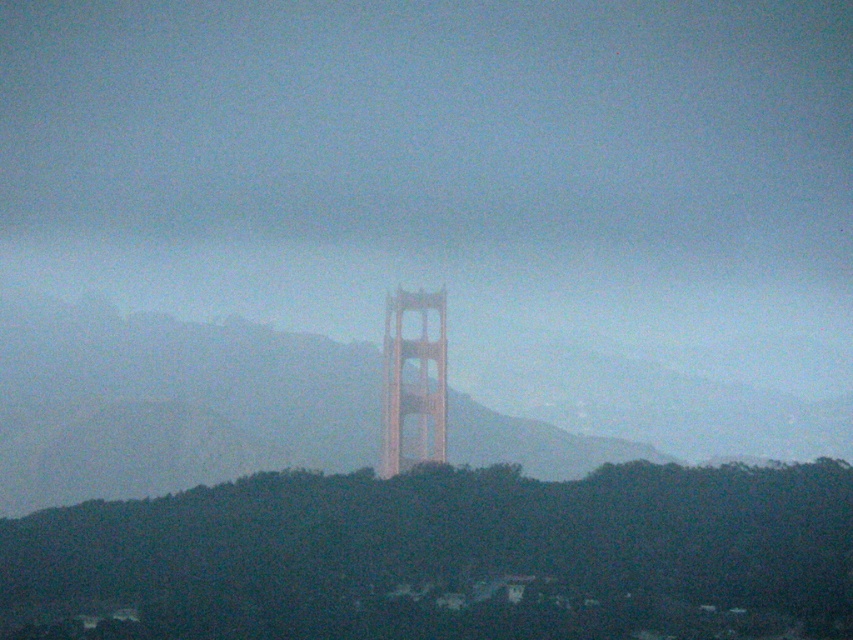
You are a photographer planning to capture the Golden Gate Bridge against the backdrop of the dark green foliage at center and the golden brown steel tower at center. Based on the scene, which object occupies a wider area in the frame?

The dark green foliage at center occupies a wider area in the frame as its width is larger than that of the golden brown steel tower at center.

You are a photographer planning to capture the Golden Gate Bridge on a foggy day. You want to ensure that both the dark green foliage at center and the golden brown steel tower at center are in focus simultaneously. Given that your camera has a depth of field range of 65 meters, will you be able to achieve this?

The dark green foliage at center and golden brown steel tower at center are 66.20 meters apart. Since the distance between them exceeds the camera depth of field range of 65 meters, the photographer cannot have both objects in focus simultaneously.

Looking at the Golden Gate Bridge scene, which object occupies more space in the image between the dark green foliage at center and the golden brown steel tower at center?

The dark green foliage at center has a larger size compared to the golden brown steel tower at center, so it occupies more space in the image.